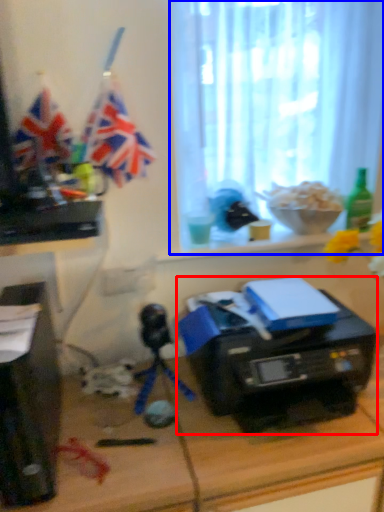
Question: Which of the following is the closest to the observer, printer (highlighted by a red box) or window screen (highlighted by a blue box)?

Choices:
 (A) printer
 (B) window screen

Answer: (A)